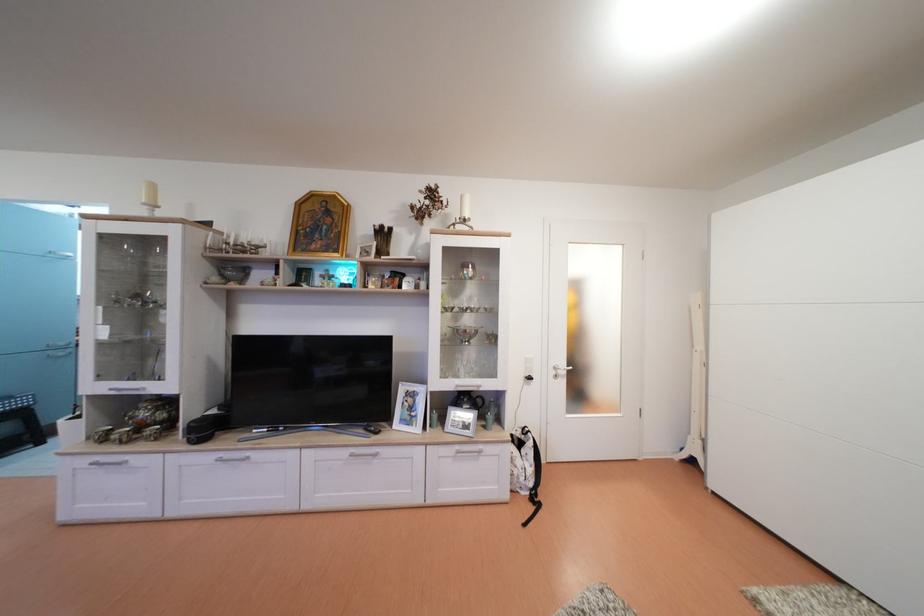
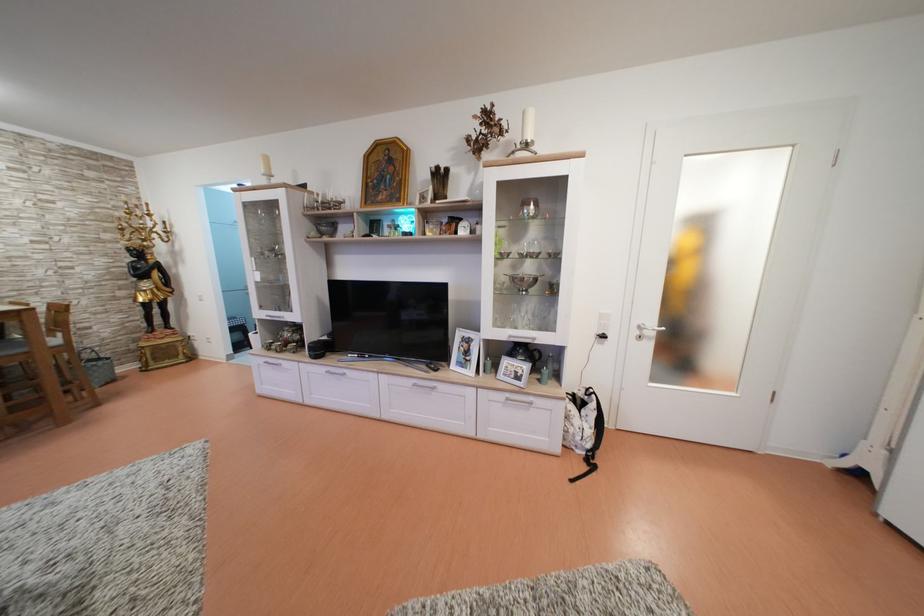
In the second image, find the point that corresponds to (x=563, y=373) in the first image.

(647, 333)